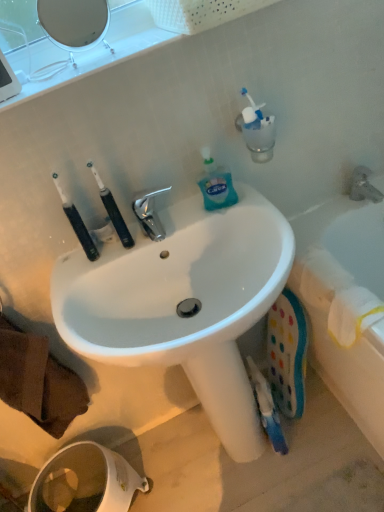
Measure the distance between point (70,221) and camera.

The depth of point (70,221) is 3.37 feet.

I want to click on translucent plastic bottle at upper right, so click(216, 184).

At what (x,y) coordinates should I click in order to perform the action: click on white plastic bathtub at right. Please return your answer as a coordinate pair (x, y). Looking at the image, I should click on click(x=345, y=304).

Where is `black rubber toothbrushes at center`? The height and width of the screenshot is (512, 384). black rubber toothbrushes at center is located at coordinates (112, 210).

Describe the element at coordinates (72, 27) in the screenshot. I see `white glossy mirror at upper left` at that location.

You are a GUI agent. You are given a task and a screenshot of the screen. Output one action in this format:
    pyautogui.click(x=<x>, y=<y>)
    Task: Click on the white glossy toilet paper at lower left
    
    Given the screenshot: What is the action you would take?
    pyautogui.click(x=85, y=481)

Locate an element on the screen. black rubber toothbrush at left is located at coordinates (77, 223).

From the image's perspective, which one is positioned lower, matte gray faucet at upper right or white plastic bathtub at right?

white plastic bathtub at right appears lower in the image.

How different are the orientations of matte gray faucet at upper right and white plastic bathtub at right in degrees?

There is a 91.5-degree angle between the facing directions of matte gray faucet at upper right and white plastic bathtub at right.

This screenshot has width=384, height=512. I want to click on tap to the right of white plastic bathtub at right, so click(363, 186).

Are matte gray faucet at upper right and white plastic bathtub at right making contact?

No, matte gray faucet at upper right is not next to white plastic bathtub at right.

Does white glossy mirror at upper left have a greater height compared to matte gray faucet at upper right?

Correct, white glossy mirror at upper left is much taller as matte gray faucet at upper right.

Is white glossy mirror at upper left in front of or behind matte gray faucet at upper right in the image?

Clearly, white glossy mirror at upper left is in front of matte gray faucet at upper right.

Are white glossy mirror at upper left and matte gray faucet at upper right beside each other?

No, white glossy mirror at upper left is not with matte gray faucet at upper right.

From the image's perspective, is white glossy sink at center under white glossy mirror at upper left?

Yes, from the image's perspective, white glossy sink at center is beneath white glossy mirror at upper left.

Looking at their sizes, would you say white glossy sink at center is wider or thinner than white glossy mirror at upper left?

In the image, white glossy sink at center appears to be wider than white glossy mirror at upper left.

Which object is closer to the camera taking this photo, white glossy sink at center or white glossy mirror at upper left?

white glossy sink at center is more forward.

Is there a large distance between white glossy sink at center and white glossy mirror at upper left?

No, white glossy sink at center is not far from white glossy mirror at upper left.

Is matte gray faucet at upper right bigger than black rubber toothbrushes at center?

Indeed, matte gray faucet at upper right has a larger size compared to black rubber toothbrushes at center.

From a real-world perspective, which object stands above the other?

In real-world perspective, black rubber toothbrushes at center is above.

Based on the photo, how different are the orientations of matte gray faucet at upper right and black rubber toothbrushes at center in degrees?

The facing directions of matte gray faucet at upper right and black rubber toothbrushes at center are 6.42 degrees apart.

Measure the distance between matte gray faucet at upper right and black rubber toothbrushes at center.

They are 28.93 inches apart.

From the image's perspective, relative to white glossy mirror at upper left, is matte gray faucet at upper right above or below?

Based on their image positions, matte gray faucet at upper right is located beneath white glossy mirror at upper left.

Considering the positions of objects matte gray faucet at upper right and white glossy mirror at upper left in the image provided, who is more to the right, matte gray faucet at upper right or white glossy mirror at upper left?

Positioned to the right is matte gray faucet at upper right.

In terms of width, does matte gray faucet at upper right look wider or thinner when compared to white glossy mirror at upper left?

Considering their sizes, matte gray faucet at upper right looks broader than white glossy mirror at upper left.

Which is more distant, [224,169] or [151,272]?

The point [224,169] is farther.

Considering the sizes of objects translucent plastic bottle at upper right and white glossy sink at center in the image provided, who is smaller, translucent plastic bottle at upper right or white glossy sink at center?

Smaller between the two is translucent plastic bottle at upper right.

Is translucent plastic bottle at upper right to the right of white glossy sink at center from the viewer's perspective?

In fact, translucent plastic bottle at upper right is to the left of white glossy sink at center.

Between translucent plastic bottle at upper right and white glossy sink at center, which one has smaller width?

Thinner between the two is translucent plastic bottle at upper right.

From the image's perspective, is white plastic bathtub at right located above or below black rubber toothbrush at left?

white plastic bathtub at right is below black rubber toothbrush at left.

Is white plastic bathtub at right spatially inside black rubber toothbrush at left, or outside of it?

white plastic bathtub at right is located beyond the bounds of black rubber toothbrush at left.

Considering the relative sizes of white plastic bathtub at right and black rubber toothbrush at left in the image provided, is white plastic bathtub at right thinner than black rubber toothbrush at left?

Incorrect, the width of white plastic bathtub at right is not less than that of black rubber toothbrush at left.

Image resolution: width=384 pixels, height=512 pixels. I want to click on tap behind the white plastic bathtub at right, so (363, 186).

You are a GUI agent. You are given a task and a screenshot of the screen. Output one action in this format:
    pyautogui.click(x=<x>, y=<y>)
    Task: Click on the tap that is under the white glossy mirror at upper left (from a real-world perspective)
    Image resolution: width=384 pixels, height=512 pixels.
    Given the screenshot: What is the action you would take?
    pyautogui.click(x=363, y=186)

Considering their positions, is white glossy sink at center positioned closer to translucent plastic bottle at upper right than black rubber toothbrush at left?

white glossy sink at center is closer to translucent plastic bottle at upper right.

From the image, which object appears to be farther from black rubber toothbrushes at center, white glossy toilet paper at lower left or white plastic bathtub at right?

white glossy toilet paper at lower left is further to black rubber toothbrushes at center.

Which object lies further to the anchor point black rubber toothbrush at left, white glossy sink at center or white plastic bathtub at right?

white plastic bathtub at right is positioned further to the anchor black rubber toothbrush at left.

Estimate the real-world distances between objects in this image. Which object is closer to black rubber toothbrushes at center, black rubber toothbrush at left or matte gray faucet at upper right?

Among the two, black rubber toothbrush at left is located nearer to black rubber toothbrushes at center.

Based on the photo, estimate the real-world distances between objects in this image. Which object is closer to black rubber toothbrushes at center, black rubber toothbrush at left or white plastic bathtub at right?

black rubber toothbrush at left is closer to black rubber toothbrushes at center.

Based on their spatial positions, is translucent plastic bottle at upper right or matte gray faucet at upper right closer to white glossy sink at center?

Among the two, translucent plastic bottle at upper right is located nearer to white glossy sink at center.

From the picture: When comparing their distances from black rubber toothbrush at left, does white plastic bathtub at right or white glossy mirror at upper left seem further?

Among the two, white plastic bathtub at right is located further to black rubber toothbrush at left.

From the image, which object appears to be farther from white glossy sink at center, black rubber toothbrushes at center or white glossy toilet paper at lower left?

white glossy toilet paper at lower left.

The width and height of the screenshot is (384, 512). I want to click on toiletries between matte gray faucet at upper right and white glossy toilet paper at lower left in the up-down direction, so click(112, 210).

Where is `tap that lies between white glossy mirror at upper left and white glossy toilet paper at lower left from top to bottom`? This screenshot has width=384, height=512. tap that lies between white glossy mirror at upper left and white glossy toilet paper at lower left from top to bottom is located at coordinates (363, 186).

In order to click on sink situated between black rubber toothbrushes at center and white plastic bathtub at right from left to right in this screenshot , I will do `click(184, 303)`.

The image size is (384, 512). What are the coordinates of `sink that lies between black rubber toothbrush at left and white glossy toilet paper at lower left from top to bottom` in the screenshot? It's located at (184, 303).